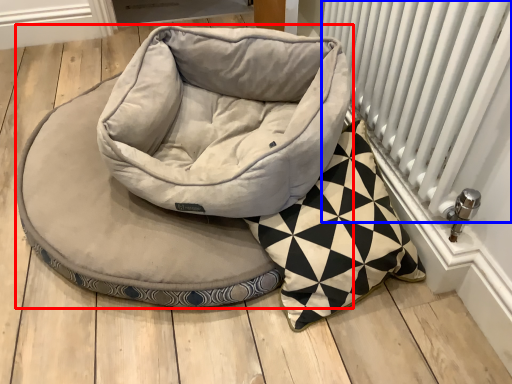
Question: Which object appears farthest to the camera in this image, dog bed (highlighted by a red box) or radiator (highlighted by a blue box)?

Choices:
 (A) dog bed
 (B) radiator

Answer: (A)